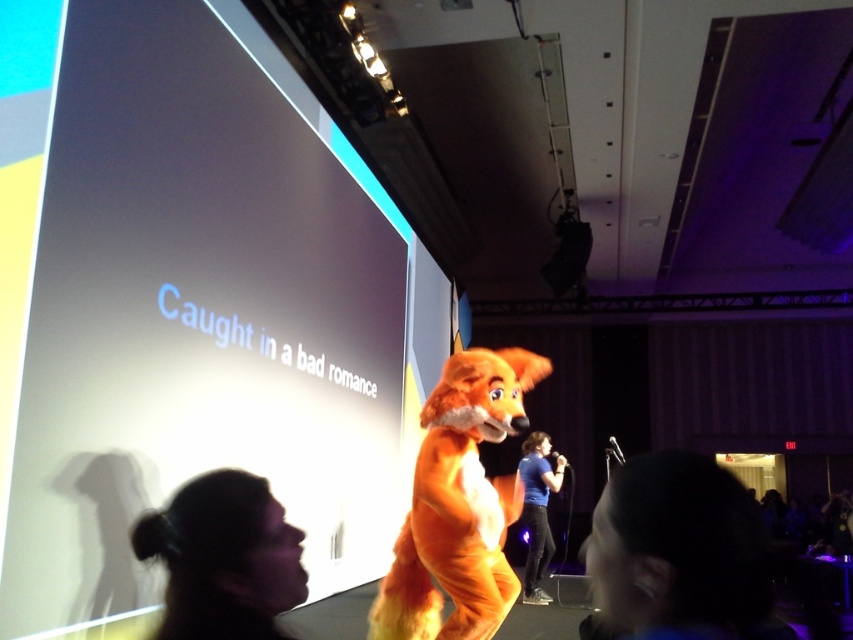
Who is more forward, (738, 632) or (421, 541)?

Positioned in front is point (738, 632).

Is point (747, 529) positioned in front of point (445, 464)?

Yes, point (747, 529) is in front of point (445, 464).

I want to click on dark hair at lower right, so click(x=679, y=554).

Who is lower down, orange furry fox at center or silky black hair at lower left?

orange furry fox at center is below.

Does point (492, 632) lie behind point (253, 593)?

That is True.

This screenshot has width=853, height=640. Identify the location of orange furry fox at center. (459, 504).

I want to click on orange furry fox at center, so click(x=459, y=504).

Who is more forward, (601, 504) or (531, 566)?

Point (601, 504) is in front.

The height and width of the screenshot is (640, 853). Find the location of `dark hair at lower right`. dark hair at lower right is located at coordinates (679, 554).